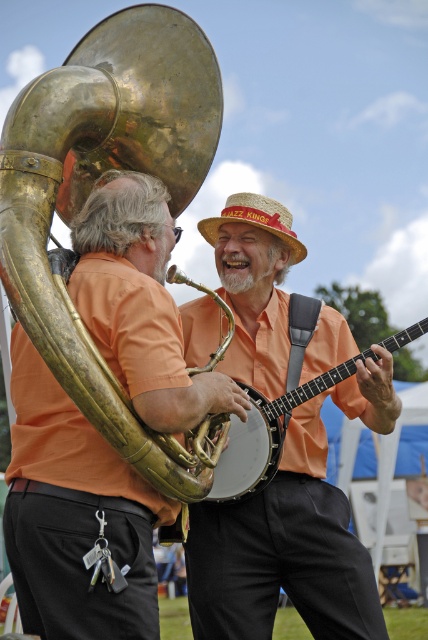
You are a photographer setting up for a jazz band photo shoot. You need to ensure that the matte orange shirt at center is visible above the gold brass trumpet at upper left in the final shot. Based on their current positions, is this possible?

The matte orange shirt at center is shorter than the gold brass trumpet at upper left, so it cannot be visible above the trumpet in the current setup.

You are a photographer at a jazz festival and need to ensure both performers are visible in your shot. The matte orange shirt at center and the gold brass trumpet at upper left are in your frame. Based on their positions, which object is closer to the camera?

The matte orange shirt at center is positioned under the gold brass trumpet at upper left, meaning the trumpet is closer to the camera since it appears above the shirt in the frame.

You are a photographer setting up for a jazz band photo shoot. You notice the matte orange shirt at center and the matte gold banjo at center in your frame. Which object should you adjust to ensure the banjo is centered in the photo?

The matte orange shirt at center is positioned on the right side of the matte gold banjo at center. To center the banjo, you should move the matte orange shirt at center to the left so the matte gold banjo at center can be centered in the frame.